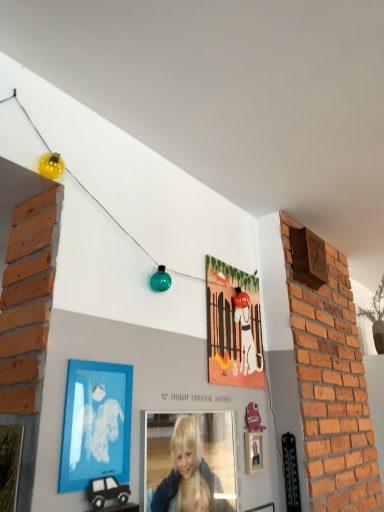
Question: Can you confirm if smooth blonde hair at center is thinner than matte paper picture frame at center, arranged as the 3th picture frame when viewed from the left?

Choices:
 (A) no
 (B) yes

Answer: (A)

Question: From a real-world perspective, is smooth blonde hair at center beneath matte paper picture frame at center, which appears as the first picture frame when viewed from the back?

Choices:
 (A) no
 (B) yes

Answer: (B)

Question: Is smooth blonde hair at center to the left of matte paper picture frame at center, the second picture frame when ordered from right to left, from the viewer's perspective?

Choices:
 (A) yes
 (B) no

Answer: (A)

Question: Is smooth blonde hair at center placed right next to matte paper picture frame at center, which is counted as the 4th picture frame, starting from the front?

Choices:
 (A) yes
 (B) no

Answer: (B)

Question: From the image's perspective, is smooth blonde hair at center located beneath matte paper picture frame at center, which is counted as the 4th picture frame, starting from the front?

Choices:
 (A) yes
 (B) no

Answer: (A)

Question: Could you tell me if smooth blonde hair at center is turned towards matte paper picture frame at center, the second picture frame when ordered from right to left?

Choices:
 (A) yes
 (B) no

Answer: (B)

Question: Can you confirm if smooth blonde hair at center is bigger than wooden picture frame at lower left, marked as the fourth picture frame in a back-to-front arrangement?

Choices:
 (A) no
 (B) yes

Answer: (B)

Question: Considering the relative positions of smooth blonde hair at center and wooden picture frame at lower left, the 1th picture frame in the front-to-back sequence, in the image provided, is smooth blonde hair at center to the right of wooden picture frame at lower left, the 1th picture frame in the front-to-back sequence, from the viewer's perspective?

Choices:
 (A) yes
 (B) no

Answer: (A)

Question: From a real-world perspective, is smooth blonde hair at center located higher than wooden picture frame at lower left, which appears as the first picture frame when viewed from the left?

Choices:
 (A) no
 (B) yes

Answer: (B)

Question: Is smooth blonde hair at center facing towards wooden picture frame at lower left, marked as the fourth picture frame in a back-to-front arrangement?

Choices:
 (A) no
 (B) yes

Answer: (A)

Question: Is the depth of smooth blonde hair at center greater than that of wooden picture frame at lower left, placed as the 4th picture frame when sorted from right to left?

Choices:
 (A) no
 (B) yes

Answer: (B)

Question: Considering the relative sizes of smooth blonde hair at center and wooden picture frame at lower left, marked as the fourth picture frame in a back-to-front arrangement, in the image provided, is smooth blonde hair at center thinner than wooden picture frame at lower left, marked as the fourth picture frame in a back-to-front arrangement,?

Choices:
 (A) no
 (B) yes

Answer: (A)

Question: Does smooth blonde hair at center have a smaller size compared to blue matte picture frame at lower left, which appears as the second picture frame when viewed from the left?

Choices:
 (A) yes
 (B) no

Answer: (B)